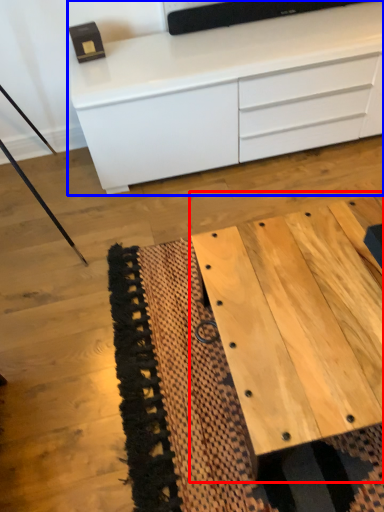
Question: Which object appears closest to the camera in this image, table (highlighted by a red box) or chest of drawers (highlighted by a blue box)?

Choices:
 (A) table
 (B) chest of drawers

Answer: (A)